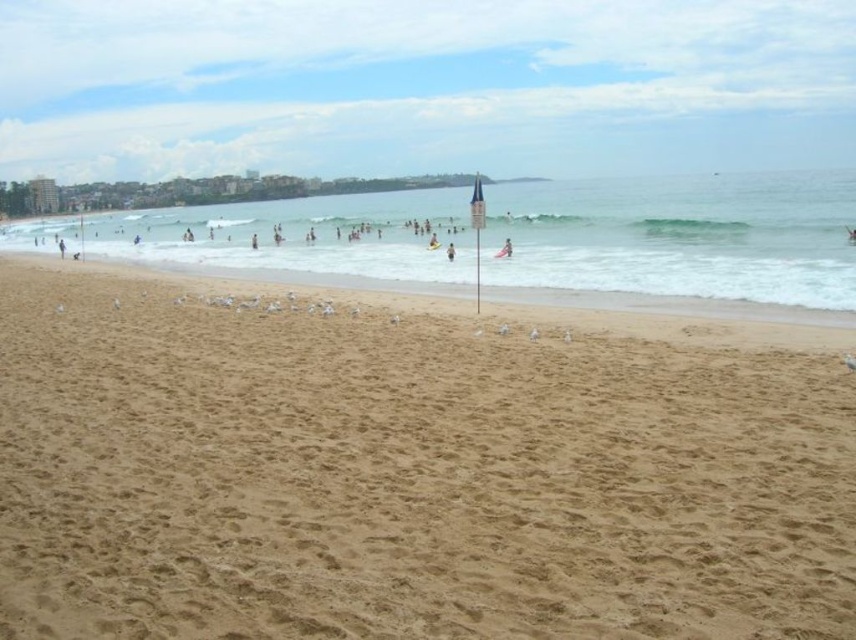
Does brown sandy beach at center have a smaller size compared to yellow rubber ring at center?

No.

Who is taller, brown sandy beach at center or yellow rubber ring at center?

With more height is brown sandy beach at center.

Describe the element at coordinates (409, 467) in the screenshot. This screenshot has height=640, width=856. I see `brown sandy beach at center` at that location.

Find the location of `brown sandy beach at center`. brown sandy beach at center is located at coordinates (409, 467).

Is point (712, 266) closer to camera compared to point (452, 259)?

That is True.

Which is above, clear blue water at center or yellow rubber ring at center?

clear blue water at center

Who is more forward, (440, 221) or (449, 248)?

Point (449, 248) is in front.

Find the location of a particular element. clear blue water at center is located at coordinates (681, 236).

Is brown sandy beach at center behind clear blue water at center?

No, it is not.

Who is more forward, (207, 497) or (557, 211)?

Point (207, 497) is in front.

Find the location of a particular element. The image size is (856, 640). brown sandy beach at center is located at coordinates (409, 467).